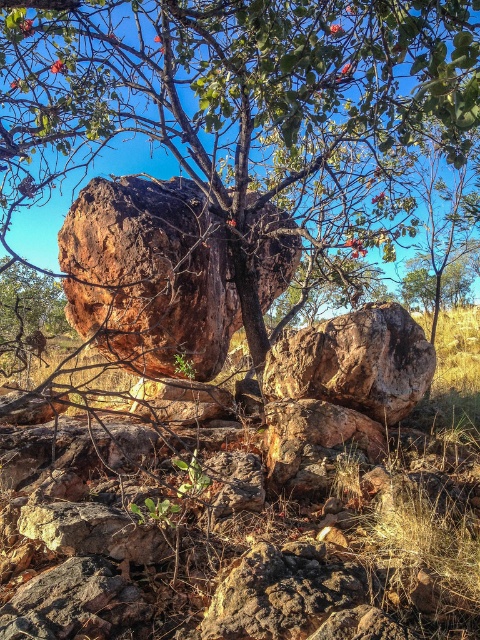
Question: Which of the following is the farthest from the observer?

Choices:
 (A) brown rough rock at center
 (B) rustic brown rock at center
 (C) rusty brown rock at center

Answer: (B)

Question: Does brown rough rock at center appear on the left side of rusty brown rock at center?

Choices:
 (A) no
 (B) yes

Answer: (A)

Question: Among these points, which one is nearest to the camera?

Choices:
 (A) (15, 140)
 (B) (156, 202)
 (C) (359, 372)

Answer: (C)

Question: Is rusty brown rock at center positioned behind rustic brown rock at center?

Choices:
 (A) no
 (B) yes

Answer: (A)

Question: Can you confirm if rusty brown rock at center is smaller than rustic brown rock at center?

Choices:
 (A) yes
 (B) no

Answer: (B)

Question: Among these points, which one is nearest to the camera?

Choices:
 (A) (422, 387)
 (B) (213, 296)
 (C) (398, 90)

Answer: (A)